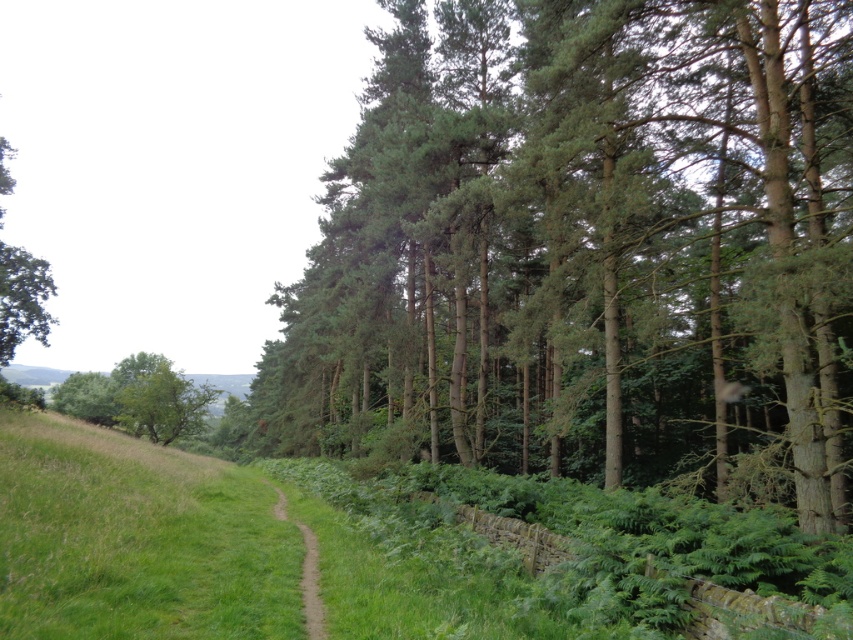
You are standing at the starting point of the dirt path in the image. There is a point marked at coordinates (585, 244) which indicates green textured trees at center. Can you walk straight ahead along the path without deviating towards the trees on the right?

The point marked at (585, 244) indicates green textured trees at center. Since the path curves gently to the left and the trees are on the right side, walking straight ahead along the path would naturally curve away from the trees, so yes, you can walk straight ahead without deviating towards the trees on the right.